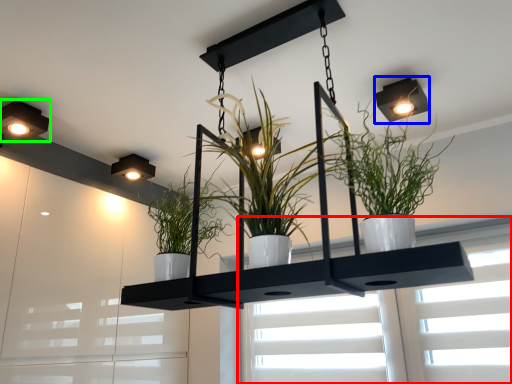
Question: Estimate the real-world distances between objects in this image. Which object is farther from window (highlighted by a red box), light fixture (highlighted by a blue box) or lamp (highlighted by a green box)?

Choices:
 (A) light fixture
 (B) lamp

Answer: (B)